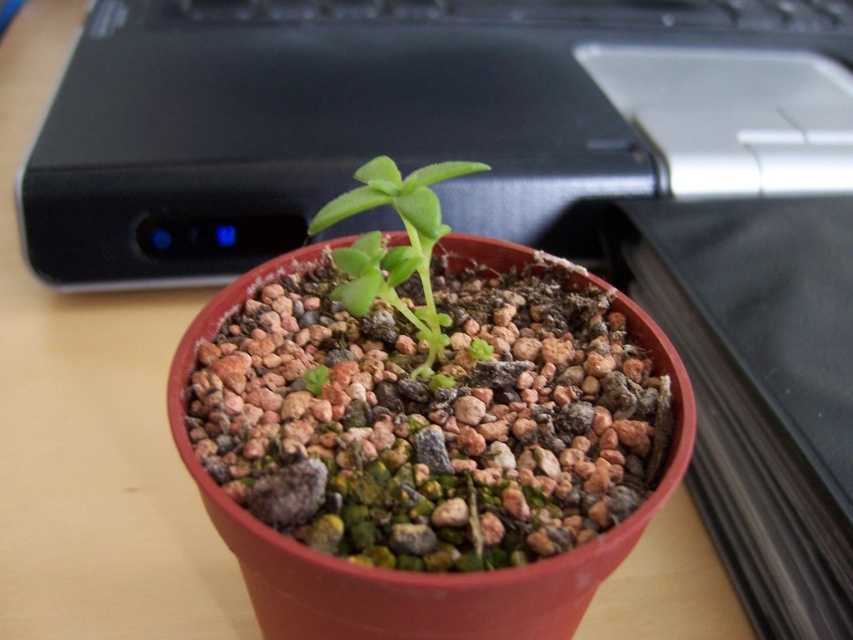
How much distance is there between black plastic keyboard at upper center and green matte plant at center?

black plastic keyboard at upper center and green matte plant at center are 89.10 centimeters apart from each other.

Who is positioned more to the left, black plastic keyboard at upper center or green matte plant at center?

green matte plant at center

Between point (564, 22) and point (482, 163), which one is positioned in front?

Point (482, 163) is in front.

The image size is (853, 640). Identify the location of black plastic keyboard at upper center. (531, 12).

Is the position of black plastic computer at upper center less distant than that of green matte plant at center?

No, it is behind green matte plant at center.

Between black plastic computer at upper center and green matte plant at center, which one has less height?

Standing shorter between the two is green matte plant at center.

Where is `black plastic computer at upper center`? The image size is (853, 640). black plastic computer at upper center is located at coordinates (412, 116).

Is point (86, 164) farther from camera compared to point (717, 4)?

That is False.

Where is `black plastic computer at upper center`? black plastic computer at upper center is located at coordinates (412, 116).